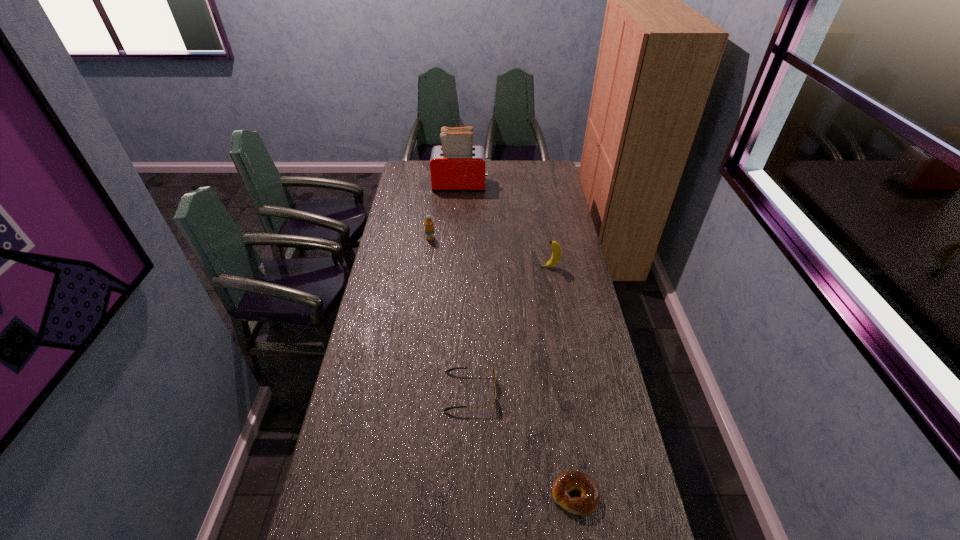
Find the location of a particular element. vacant area situated from the stem of the banana is located at coordinates (493, 267).

Where is `vacant space located 0.220m from the stem of the banana`? vacant space located 0.220m from the stem of the banana is located at coordinates (489, 267).

At what (x,y) coordinates should I click in order to perform the action: click on free spot located 0.310m from the stem of the banana. Please return your answer as a coordinate pair (x, y). The image size is (960, 540). Looking at the image, I should click on (468, 267).

I want to click on free space located 0.190m on the label of the second farthest object, so click(x=426, y=269).

You are a GUI agent. You are given a task and a screenshot of the screen. Output one action in this format:
    pyautogui.click(x=<x>, y=<y>)
    Task: Click on the blank space located on the front-facing side of the fourth farthest object
    The width and height of the screenshot is (960, 540).
    Given the screenshot: What is the action you would take?
    pyautogui.click(x=593, y=392)

At what (x,y) coordinates should I click in order to perform the action: click on vacant area situated on the left of the shortest object. Please return your answer as a coordinate pair (x, y). This screenshot has height=540, width=960. Looking at the image, I should click on (516, 494).

Where is `object present at the far edge`? object present at the far edge is located at coordinates (456, 165).

The image size is (960, 540). I want to click on banana that is at the right edge, so click(x=556, y=254).

This screenshot has height=540, width=960. I want to click on bagel that is positioned at the right edge, so click(x=569, y=481).

I want to click on free location at the far edge, so click(489, 170).